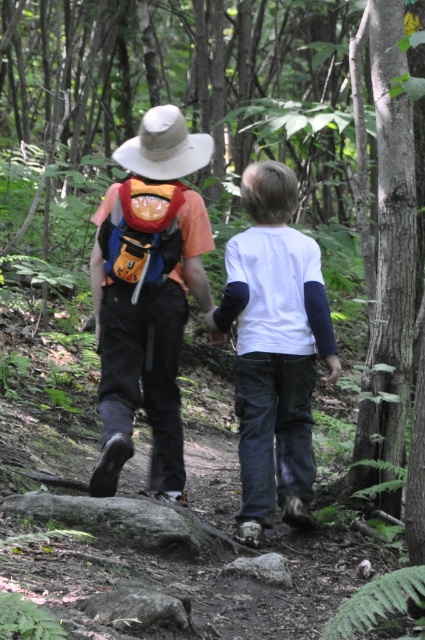
Question: Is matte orange backpack at center further to the viewer compared to white cotton shirt at center?

Choices:
 (A) yes
 (B) no

Answer: (B)

Question: Among these objects, which one is farthest from the camera?

Choices:
 (A) matte orange backpack at center
 (B) orange fabric backpack at center
 (C) beige fabric cowboy hat at upper center

Answer: (B)

Question: In this image, where is matte orange backpack at center located relative to white cotton shirt at center?

Choices:
 (A) left
 (B) right

Answer: (A)

Question: Which point is farther to the camera?

Choices:
 (A) orange fabric backpack at center
 (B) beige fabric cowboy hat at upper center

Answer: (A)

Question: Can you confirm if white cotton shirt at center is smaller than beige fabric cowboy hat at upper center?

Choices:
 (A) yes
 (B) no

Answer: (B)

Question: Which point is closer to the camera?

Choices:
 (A) orange fabric backpack at center
 (B) beige fabric cowboy hat at upper center
 (C) matte orange backpack at center

Answer: (C)